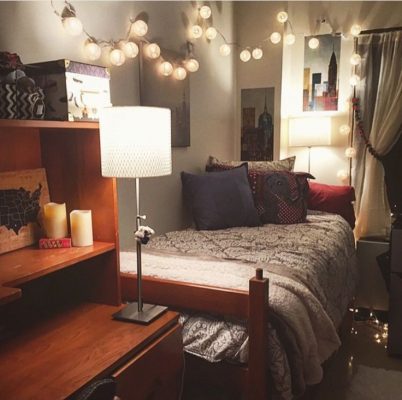
Locate an element on the screen. candle is located at coordinates (60, 208).